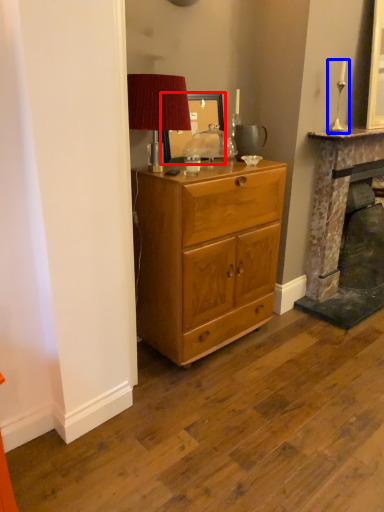
Question: Among these objects, which one is farthest to the camera, picture frame (highlighted by a red box) or candle holder (highlighted by a blue box)?

Choices:
 (A) picture frame
 (B) candle holder

Answer: (B)